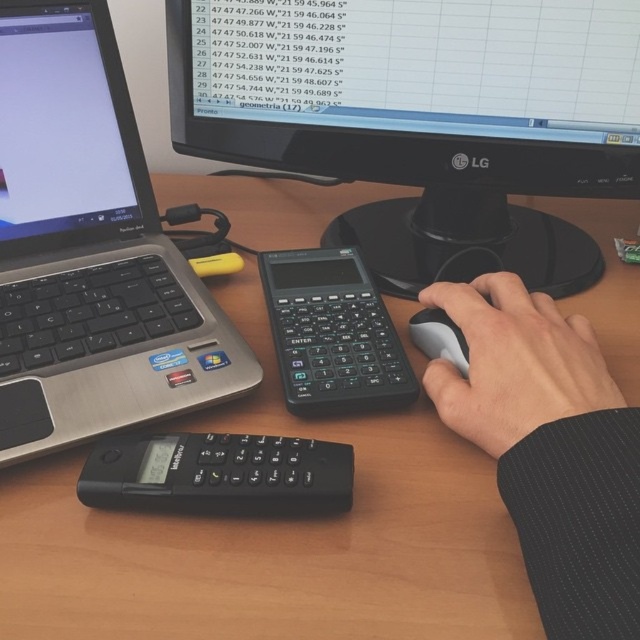
You are setting up your desk and want to place a new lamp between the black plastic monitor at upper center and the black plastic keyboard at left. Based on their positions, where should you place the lamp?

The black plastic monitor at upper center is to the right of the black plastic keyboard at left, so you should place the lamp between them, positioning it to the right of the keyboard and to the left of the monitor.

You are setting up a new desk arrangement and want to place a tall plant between the black plastic monitor at upper center and the black plastic keyboard at left. Based on their heights, which object should the plant be placed closer to?

The black plastic monitor at upper center is much taller than the black plastic keyboard at left, so the plant should be placed closer to the black plastic keyboard at left to maintain balance in height.

You are a person with a 50 cm long arm. You want to reach the black plastic calculator at center from your current position. Can you comfortably reach it?

The black plastic calculator at center is 44.85 centimeters away from the viewer. Since your arm is 50 cm long, you can comfortably reach it.